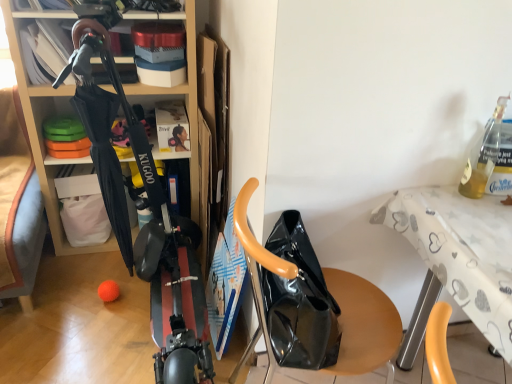
You are a GUI agent. You are given a task and a screenshot of the screen. Output one action in this format:
    pyautogui.click(x=<x>, y=<y>)
    Task: Click on the matte black umbrella at left
    The height and width of the screenshot is (384, 512).
    Given the screenshot: What is the action you would take?
    pyautogui.click(x=39, y=128)

The height and width of the screenshot is (384, 512). Describe the element at coordinates (483, 155) in the screenshot. I see `translucent glass bottle at upper right` at that location.

Where is `black glossy scooter at center`? black glossy scooter at center is located at coordinates (144, 208).

Locate an element on the screen. glossy black bag at center is located at coordinates (362, 324).

At what (x,y) coordinates should I click in order to perform the action: click on white printed fabric table at upper right. Please return your answer as a coordinate pair (x, y). Looking at the image, I should click on (461, 251).

Can you confirm if black glossy scooter at center is wider than matte black umbrella at left?

No.

Is point (105, 49) positioned after point (19, 66)?

No.

Considering the sizes of objects black glossy scooter at center and matte black umbrella at left in the image provided, who is bigger, black glossy scooter at center or matte black umbrella at left?

Bigger between the two is black glossy scooter at center.

Consider the image. From a real-world perspective, who is located lower, translucent glass bottle at upper right or glossy black bag at center?

In real-world perspective, glossy black bag at center is lower.

Is translucent glass bottle at upper right positioned far away from glossy black bag at center?

No, translucent glass bottle at upper right is in close proximity to glossy black bag at center.

Is translucent glass bottle at upper right positioned behind glossy black bag at center?

That is True.

I want to click on furniture lying on the left of translucent glass bottle at upper right, so click(362, 324).

Consider the image. Is translucent glass bottle at upper right further to camera compared to white printed fabric table at upper right?

Yes, translucent glass bottle at upper right is further from the viewer.

Which object is thinner, translucent glass bottle at upper right or white printed fabric table at upper right?

With smaller width is translucent glass bottle at upper right.

In the scene shown: Between translucent glass bottle at upper right and white printed fabric table at upper right, which one has larger size?

white printed fabric table at upper right.

Are matte black umbrella at left and black glossy scooter at center far apart?

matte black umbrella at left is actually quite close to black glossy scooter at center.

From a real-world perspective, which object stands above the other?

In real-world perspective, black glossy scooter at center is above.

Which object is thinner, matte black umbrella at left or black glossy scooter at center?

Thinner between the two is black glossy scooter at center.

Based on the photo, is glossy black bag at center positioned with its back to black glossy scooter at center?

Yes, glossy black bag at center is positioned with its back facing black glossy scooter at center.

From the picture: Considering the positions of objects glossy black bag at center and black glossy scooter at center in the image provided, who is behind, glossy black bag at center or black glossy scooter at center?

glossy black bag at center is further away from the camera.

Between point (327, 284) and point (170, 248), which one is positioned in front?

The point (327, 284) is in front.

Measure the distance from black glossy scooter at center to glossy black bag at center.

black glossy scooter at center and glossy black bag at center are 50.86 centimeters apart.

From a real-world perspective, is black glossy scooter at center under glossy black bag at center?

Actually, black glossy scooter at center is physically above glossy black bag at center in the real world.

Is black glossy scooter at center facing towards glossy black bag at center?

No.

Can you see black glossy scooter at center touching glossy black bag at center?

There is a gap between black glossy scooter at center and glossy black bag at center.

The image size is (512, 384). I want to click on shelf on the left of glossy black bag at center, so click(39, 128).

Are glossy black bag at center and matte black umbrella at left beside each other?

glossy black bag at center and matte black umbrella at left are not in contact.

Which object is further away from the camera taking this photo, glossy black bag at center or matte black umbrella at left?

matte black umbrella at left is further away from the camera.

Between glossy black bag at center and matte black umbrella at left, which one appears on the left side from the viewer's perspective?

matte black umbrella at left.

In the image, there is a black glossy scooter at center. Where is `shelf below it (from a real-world perspective)`? The height and width of the screenshot is (384, 512). shelf below it (from a real-world perspective) is located at coordinates (39, 128).

Where is `bottle above the glossy black bag at center (from a real-world perspective)`? bottle above the glossy black bag at center (from a real-world perspective) is located at coordinates (483, 155).

Looking at the image, which one is located closer to black glossy scooter at center, translucent glass bottle at upper right or white printed fabric table at upper right?

Among the two, white printed fabric table at upper right is located nearer to black glossy scooter at center.

Based on their spatial positions, is black glossy scooter at center or glossy black bag at center further from translucent glass bottle at upper right?

Based on the image, black glossy scooter at center appears to be further to translucent glass bottle at upper right.

From the image, which object appears to be nearer to matte black umbrella at left, black glossy scooter at center or glossy black bag at center?

black glossy scooter at center is positioned closer to the anchor matte black umbrella at left.

When comparing their distances from matte black umbrella at left, does white printed fabric table at upper right or translucent glass bottle at upper right seem closer?

white printed fabric table at upper right is closer to matte black umbrella at left.

Which object lies further to the anchor point translucent glass bottle at upper right, matte black umbrella at left or black glossy scooter at center?

The object further to translucent glass bottle at upper right is matte black umbrella at left.

Considering their positions, is black glossy scooter at center positioned closer to matte black umbrella at left than translucent glass bottle at upper right?

Based on the image, black glossy scooter at center appears to be nearer to matte black umbrella at left.

Estimate the real-world distances between objects in this image. Which object is closer to matte black umbrella at left, glossy black bag at center or white printed fabric table at upper right?

The object closer to matte black umbrella at left is glossy black bag at center.

Which object lies nearer to the anchor point matte black umbrella at left, glossy black bag at center or translucent glass bottle at upper right?

glossy black bag at center lies closer to matte black umbrella at left than the other object.

Where is `sport equipment between matte black umbrella at left and translucent glass bottle at upper right`? sport equipment between matte black umbrella at left and translucent glass bottle at upper right is located at coordinates (144, 208).

Where is `bottle situated between matte black umbrella at left and white printed fabric table at upper right from left to right`? This screenshot has width=512, height=384. bottle situated between matte black umbrella at left and white printed fabric table at upper right from left to right is located at coordinates (483, 155).

You are a GUI agent. You are given a task and a screenshot of the screen. Output one action in this format:
    pyautogui.click(x=<x>, y=<y>)
    Task: Click on the furniture located between black glossy scooter at center and matte black umbrella at left in the depth direction
    
    Given the screenshot: What is the action you would take?
    pyautogui.click(x=362, y=324)

In order to click on furniture situated between matte black umbrella at left and white printed fabric table at upper right from left to right in this screenshot , I will do `click(362, 324)`.